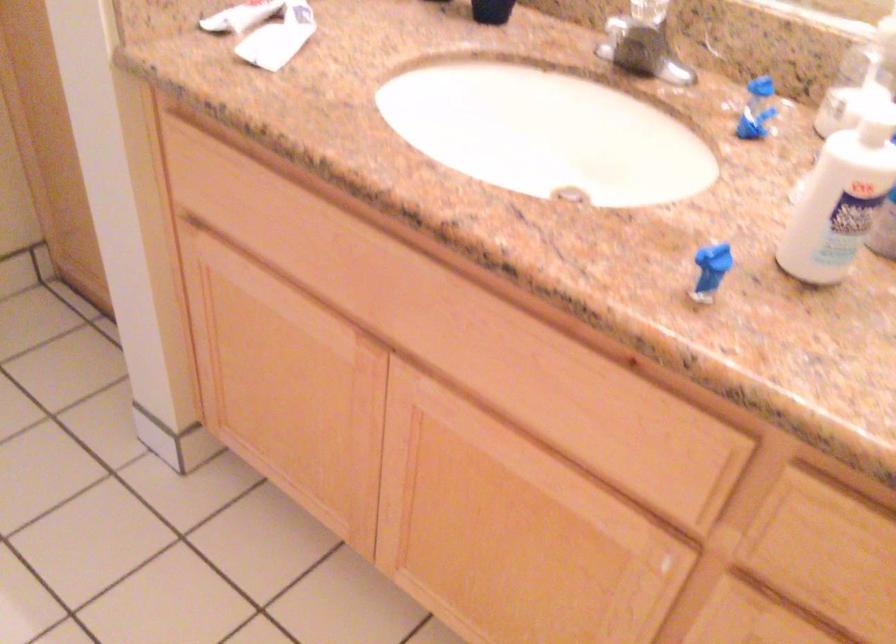
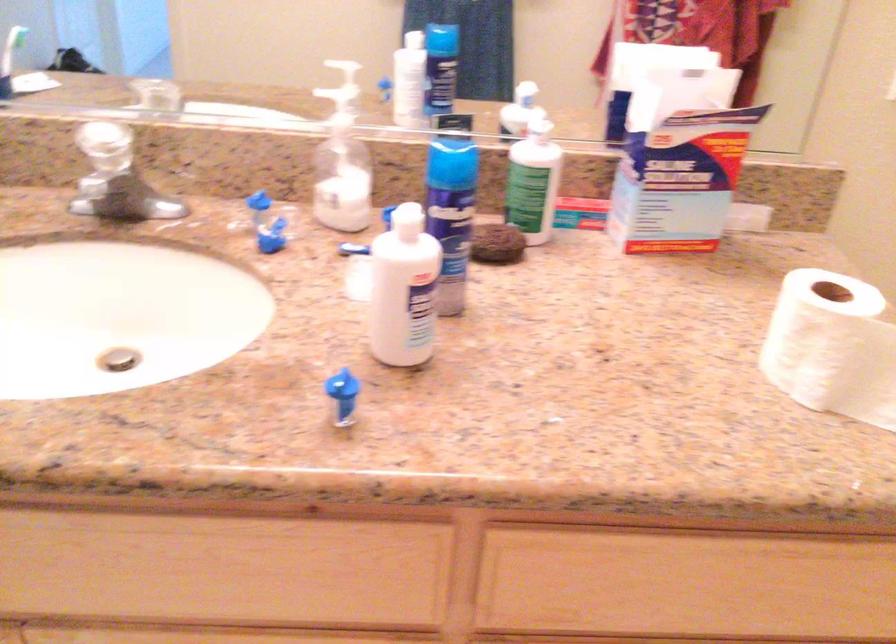
Where in the second image is the point corresponding to point (716, 261) from the first image?

(341, 386)